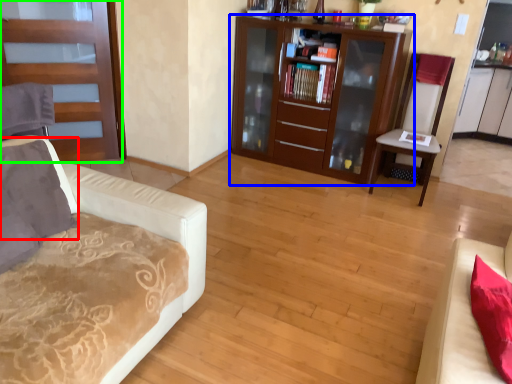
Question: Considering the real-world distances, which object is farthest from pillow (highlighted by a red box)? cabinetry (highlighted by a blue box) or door (highlighted by a green box)?

Choices:
 (A) cabinetry
 (B) door

Answer: (A)